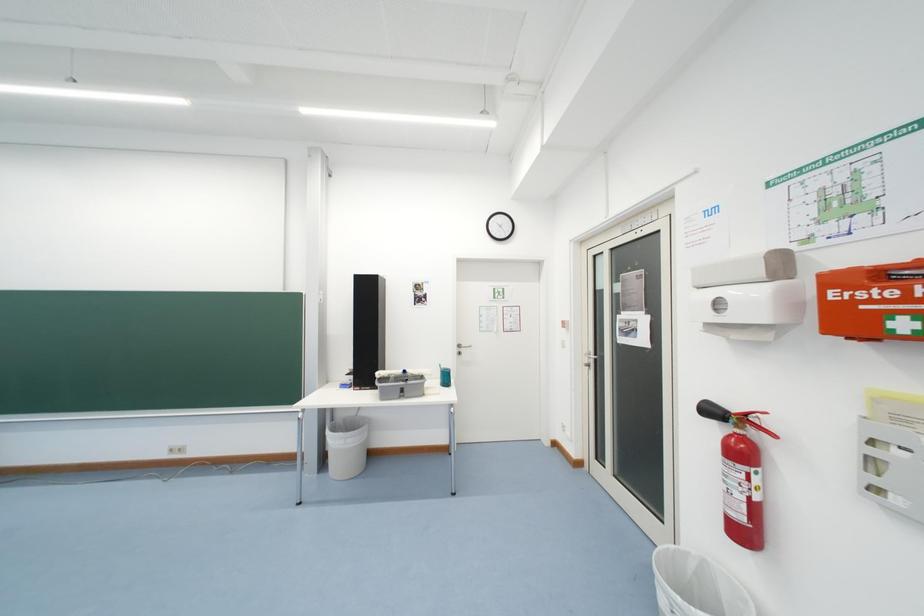
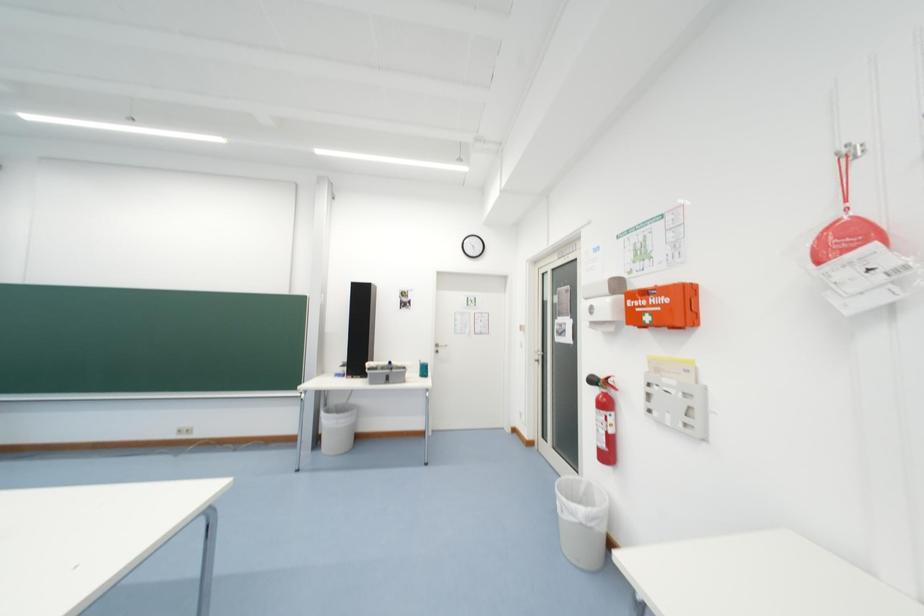
Question: In a continuous first-person perspective shot, in which direction is the camera moving?

Choices:
 (A) Left
 (B) Right
 (C) Forward
 (D) Backward

Answer: (D)